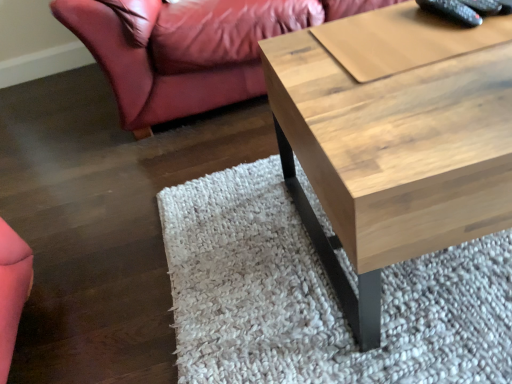
What is the approximate height of natural wood coffee table at center?

17.49 inches.

Where is `natural wood coffee table at center`? natural wood coffee table at center is located at coordinates click(x=392, y=159).

Describe the element at coordinates (392, 159) in the screenshot. I see `natural wood coffee table at center` at that location.

At what (x,y) coordinates should I click in order to perform the action: click on natural wood coffee table at center. Please return your answer as a coordinate pair (x, y). This screenshot has width=512, height=384. Looking at the image, I should click on (392, 159).